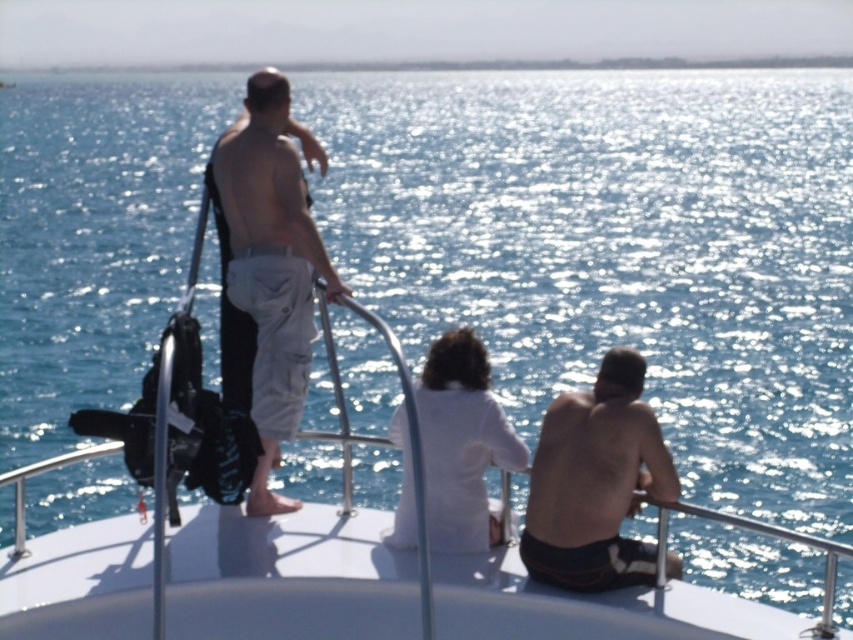
Question: Which point is farther to the camera?

Choices:
 (A) light gray cotton shorts at center
 (B) white cotton shirt at center
 (C) smooth skin torso at right

Answer: (A)

Question: Is the position of light gray cotton shorts at center less distant than that of smooth skin torso at right?

Choices:
 (A) no
 (B) yes

Answer: (A)

Question: Can you confirm if smooth skin torso at right is positioned above white cotton shirt at center?

Choices:
 (A) yes
 (B) no

Answer: (B)

Question: Estimate the real-world distances between objects in this image. Which object is closer to the smooth skin torso at right?

Choices:
 (A) white cotton shirt at center
 (B) light gray cotton shorts at center

Answer: (A)

Question: Which object is farther from the camera taking this photo?

Choices:
 (A) light gray cotton shorts at center
 (B) white cotton shirt at center

Answer: (A)

Question: Observing the image, what is the correct spatial positioning of light gray cotton shorts at center in reference to smooth skin torso at right?

Choices:
 (A) below
 (B) above

Answer: (B)